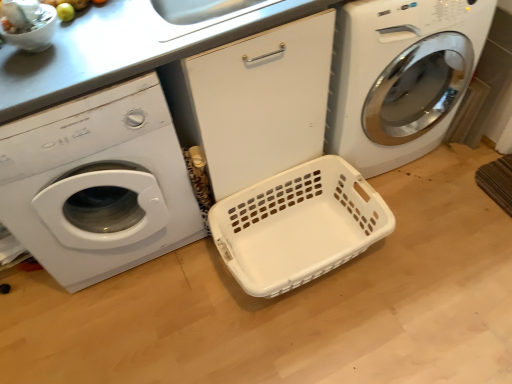
Find the location of a particular element. vacant space to the right of white plastic basket at center is located at coordinates (434, 254).